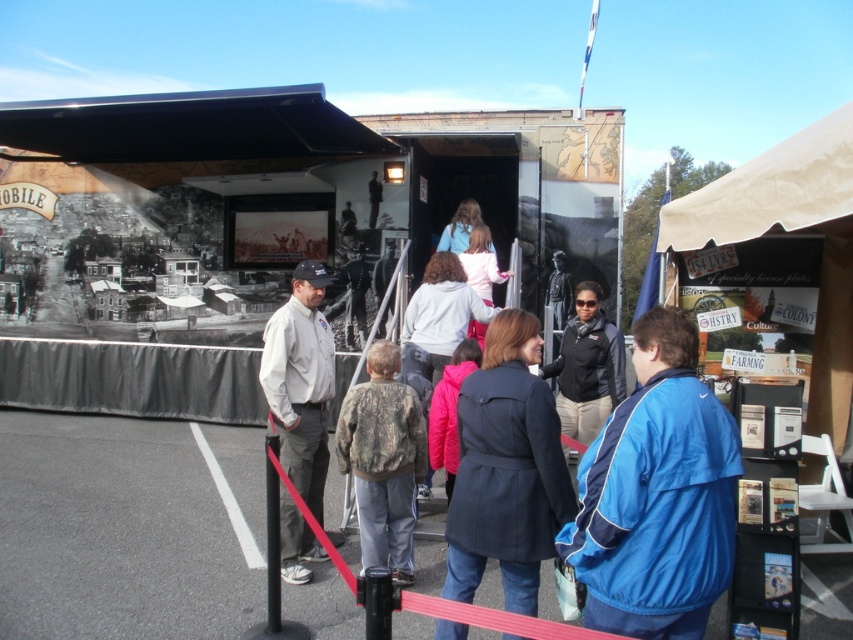
Does khaki cotton shirt at left have a larger size compared to camouflage jacket at center?

Yes, khaki cotton shirt at left is bigger than camouflage jacket at center.

Between point (329, 339) and point (352, 445), which one is positioned in front?

Positioned in front is point (352, 445).

Measure the distance between point (x=291, y=376) and camera.

They are 15.86 feet apart.

Where is `khaki cotton shirt at left`? This screenshot has height=640, width=853. khaki cotton shirt at left is located at coordinates (300, 381).

Does beige canvas canopy at upper right have a greater height compared to white painted line at center?

Correct, beige canvas canopy at upper right is much taller as white painted line at center.

Between beige canvas canopy at upper right and white painted line at center, which one is positioned higher?

beige canvas canopy at upper right is higher up.

Identify the location of beige canvas canopy at upper right. The width and height of the screenshot is (853, 640). (769, 189).

Who is higher up, dark blue coat at center or black fleece jacket at center?

black fleece jacket at center

Is point (526, 401) farther from camera compared to point (585, 444)?

No.

Is point (468, 547) closer to viewer compared to point (575, 326)?

Yes, it is in front of point (575, 326).

Find the location of a particular element. The image size is (853, 640). dark blue coat at center is located at coordinates (506, 468).